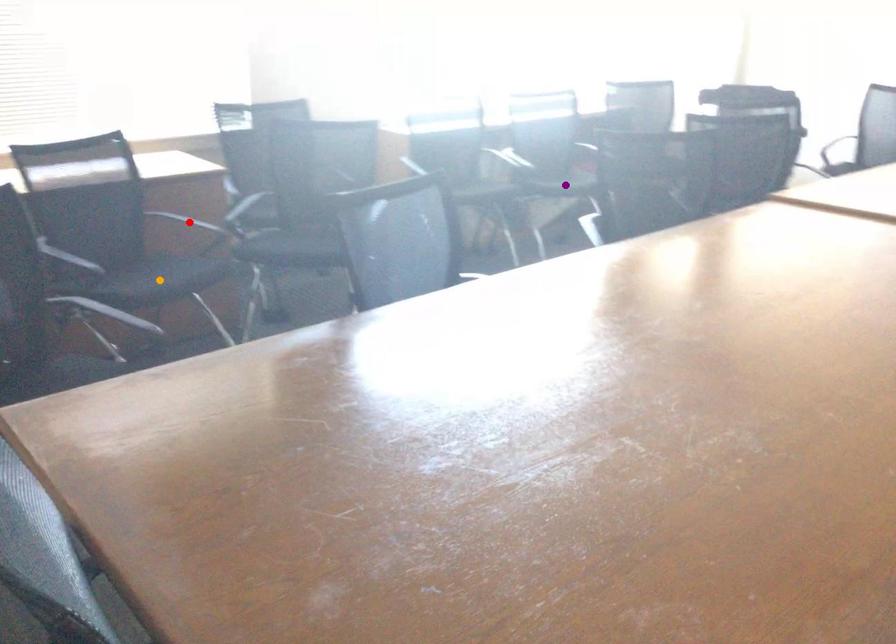
Order these from nearest to farthest:
purple point | red point | orange point

orange point < red point < purple point